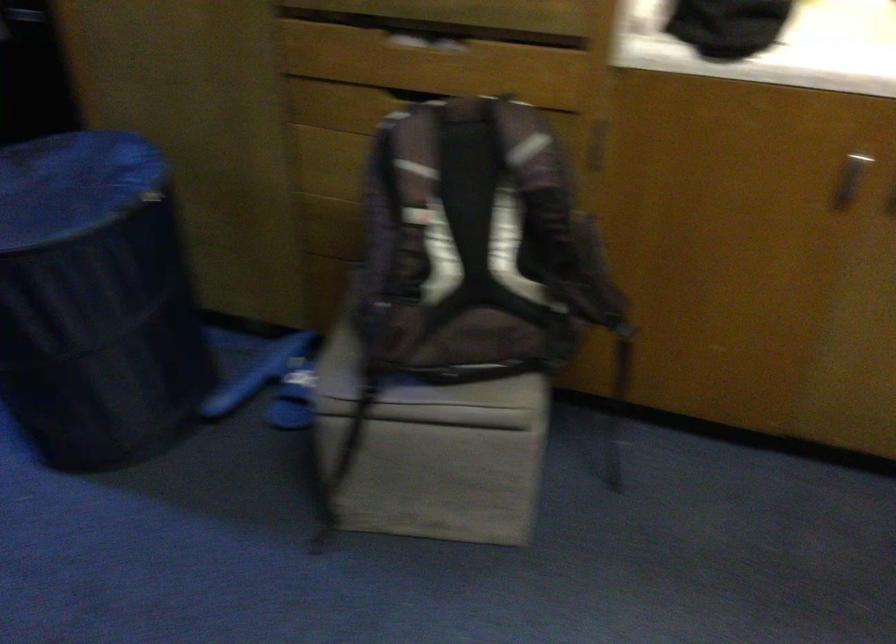
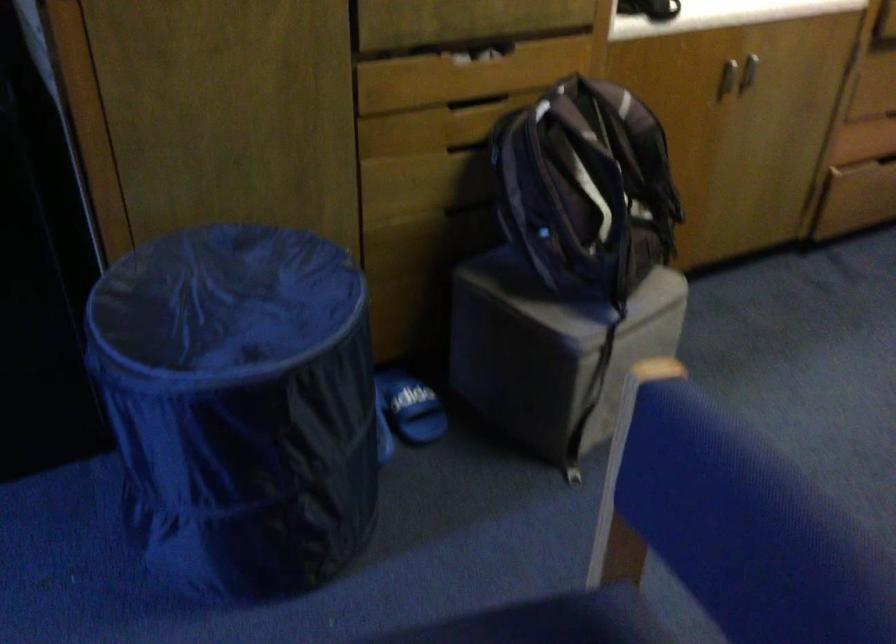
Where in the second image is the point corresponding to (435,237) from the first image?

(586, 187)